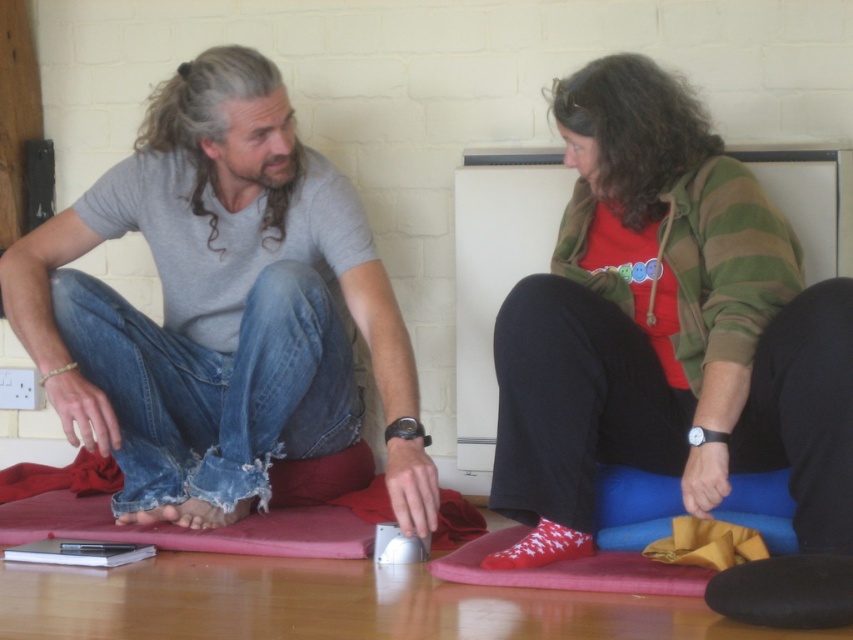
Question: Does matte gray t-shirt at center have a larger size compared to red socks at center?

Choices:
 (A) yes
 (B) no

Answer: (A)

Question: Can you confirm if matte gray t-shirt at center is positioned to the right of red socks at center?

Choices:
 (A) no
 (B) yes

Answer: (A)

Question: Which of the following is the closest to the observer?

Choices:
 (A) matte gray t-shirt at center
 (B) red socks at center

Answer: (B)

Question: Is matte gray t-shirt at center in front of red socks at center?

Choices:
 (A) yes
 (B) no

Answer: (B)

Question: Which object is closer to the camera taking this photo?

Choices:
 (A) red socks at center
 (B) matte gray t-shirt at center

Answer: (A)